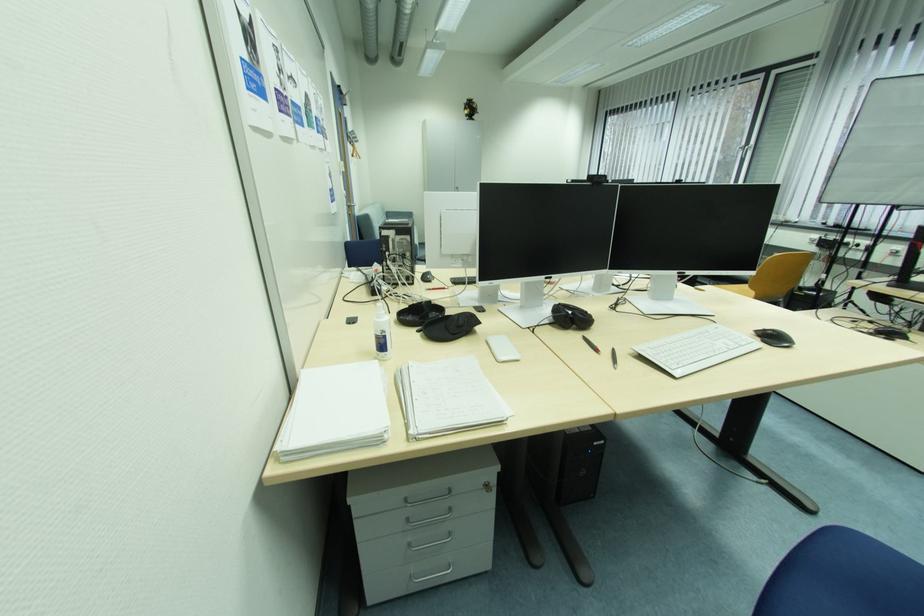
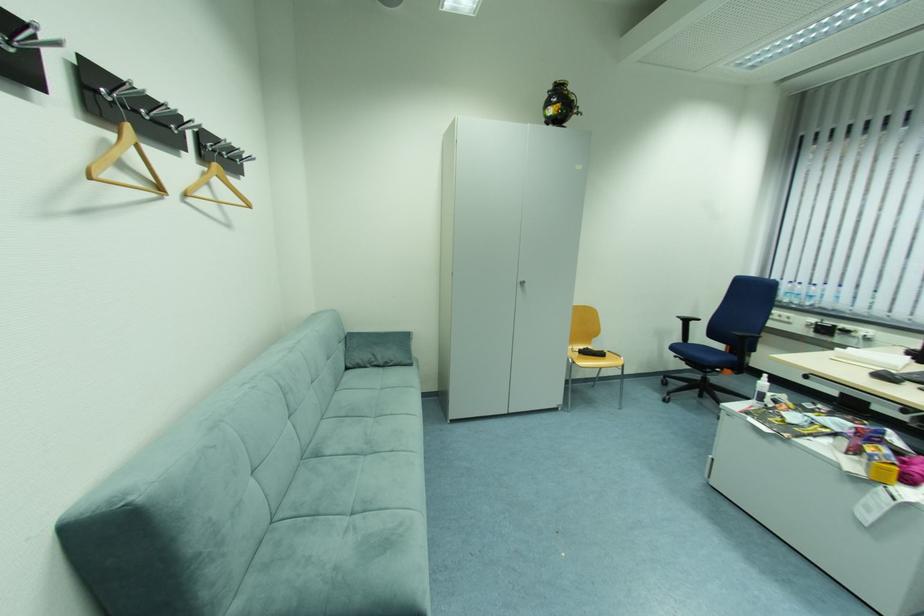
Locate, in the second image, the point that corresponds to (x=463, y=187) in the first image.

(527, 281)